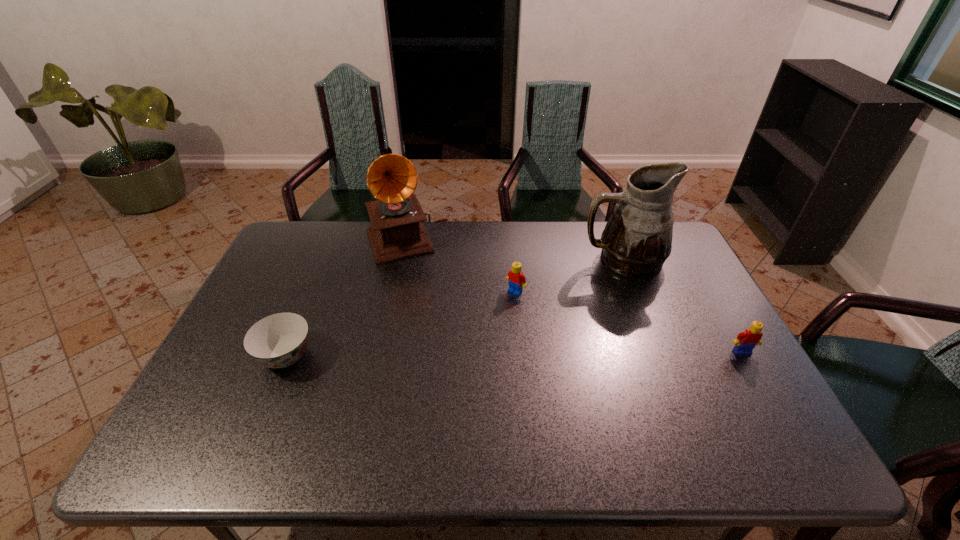
At what (x,y) coordinates should I click in order to perform the action: click on empty location between the phonograph record and the third object from left to right. Please return your answer as a coordinate pair (x, y). Looking at the image, I should click on tap(461, 266).

Identify the location of object that ranks as the closest to the fourth object from right to left. The image size is (960, 540). (516, 280).

Image resolution: width=960 pixels, height=540 pixels. I want to click on the closest object relative to the phonograph record, so click(516, 280).

Identify the location of vacant space that satisfies the following two spatial constraints: 1. on the front side of the left Lego; 2. on the left side of the fourth object from right to left. The image size is (960, 540). (396, 292).